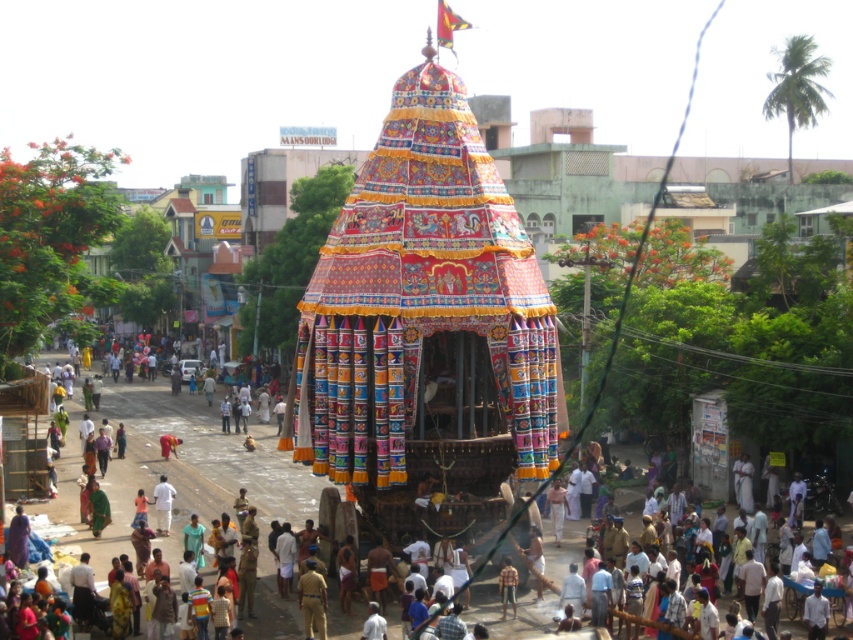
Question: Based on their relative distances, which object is nearer to the wooden cart at center?

Choices:
 (A) striped shirt at center
 (B) white cotton cloth at center
 (C) brown uniform at center

Answer: (B)

Question: From the image, what is the correct spatial relationship of wooden cart at center in relation to striped shirt at center?

Choices:
 (A) above
 (B) below

Answer: (A)

Question: Is white cotton cloth at center to the right of striped shirt at center from the viewer's perspective?

Choices:
 (A) yes
 (B) no

Answer: (B)

Question: Can you confirm if white cotton cloth at center is bigger than striped shirt at center?

Choices:
 (A) yes
 (B) no

Answer: (A)

Question: Among these points, which one is farthest from the camera?

Choices:
 (A) (56, 465)
 (B) (306, 625)
 (C) (515, 605)

Answer: (A)

Question: Which point is farther from the camera taking this photo?

Choices:
 (A) (509, 634)
 (B) (160, 525)
 (C) (317, 636)
 (D) (505, 605)

Answer: (B)